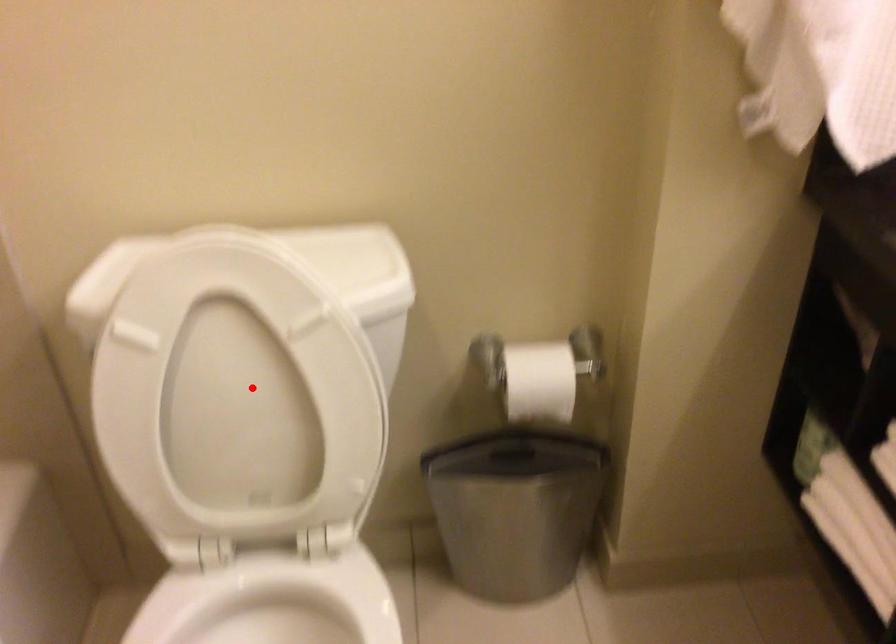
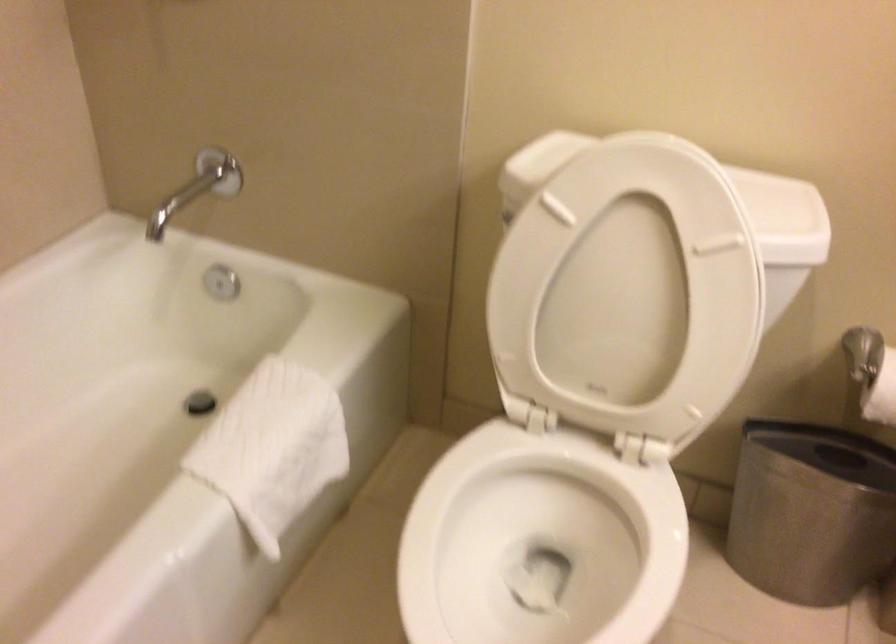
Find the pixel in the second image that matches the highlighted location in the first image.

(633, 285)